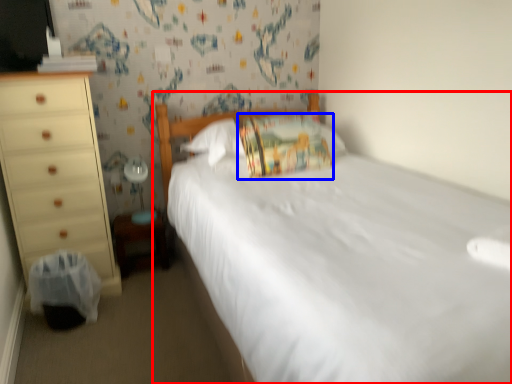
Question: Among these objects, which one is nearest to the camera, bed (highlighted by a red box) or pillow (highlighted by a blue box)?

Choices:
 (A) bed
 (B) pillow

Answer: (A)